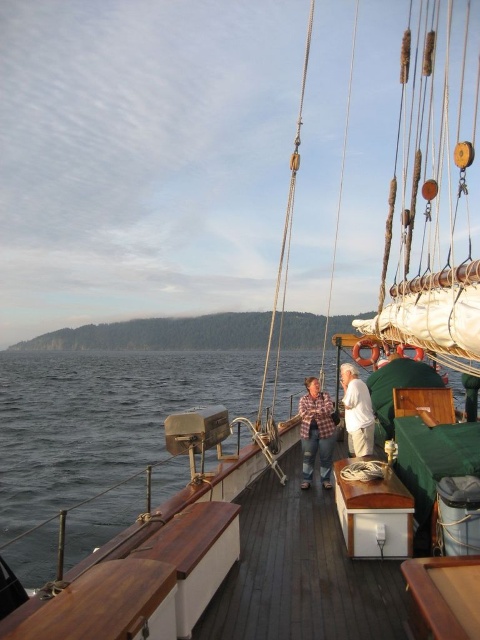
You are navigating a small drone that needs to fly from the point at coordinates point (301, 420) to the point at coordinates point (360, 444) on the ship. Based on the scene description, will the drone have an unobstructed path between these two points?

Point (301, 420) is behind point (360, 444), so the drone will have an unobstructed path between these two points since the first point is positioned behind the second one.

You are a photographer on the deck of the ship and want to capture both the plaid shirt at center and the white cotton shirt at center in the same frame. Which shirt should you focus on to ensure both are visible without zooming in or out?

The plaid shirt at center has a lesser width compared to the white cotton shirt at center, so focusing on the white cotton shirt at center would allow both to be visible in the frame since it takes up more space and the plaid shirt is narrower.